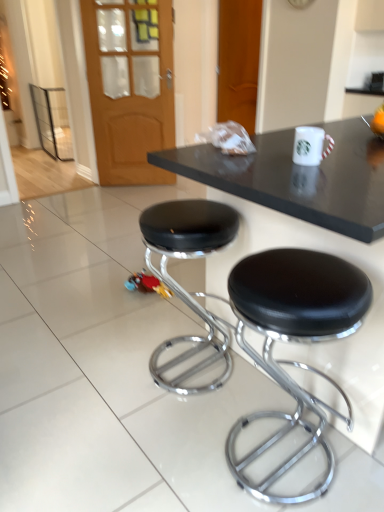
Question: Considering the relative positions of black glossy table at center and black leather stool at lower right, positioned as the second stool in left-to-right order, in the image provided, is black glossy table at center to the left or to the right of black leather stool at lower right, positioned as the second stool in left-to-right order,?

Choices:
 (A) left
 (B) right

Answer: (B)

Question: Is black glossy table at center bigger or smaller than black leather stool at lower right, the first stool from the right?

Choices:
 (A) small
 (B) big

Answer: (B)

Question: Which of these objects is positioned closest to the black glossy table at center?

Choices:
 (A) black leather stool at lower right, positioned as the second stool in left-to-right order
 (B) wooden door at upper left
 (C) wooden door at upper center
 (D) black leather stool at center, which ranks as the 1th stool in left-to-right order

Answer: (A)

Question: Estimate the real-world distances between objects in this image. Which object is closer to the wooden door at upper center?

Choices:
 (A) black glossy table at center
 (B) wooden door at upper left
 (C) black leather stool at lower right, positioned as the second stool in left-to-right order
 (D) black leather stool at center, which ranks as the 1th stool in left-to-right order

Answer: (B)